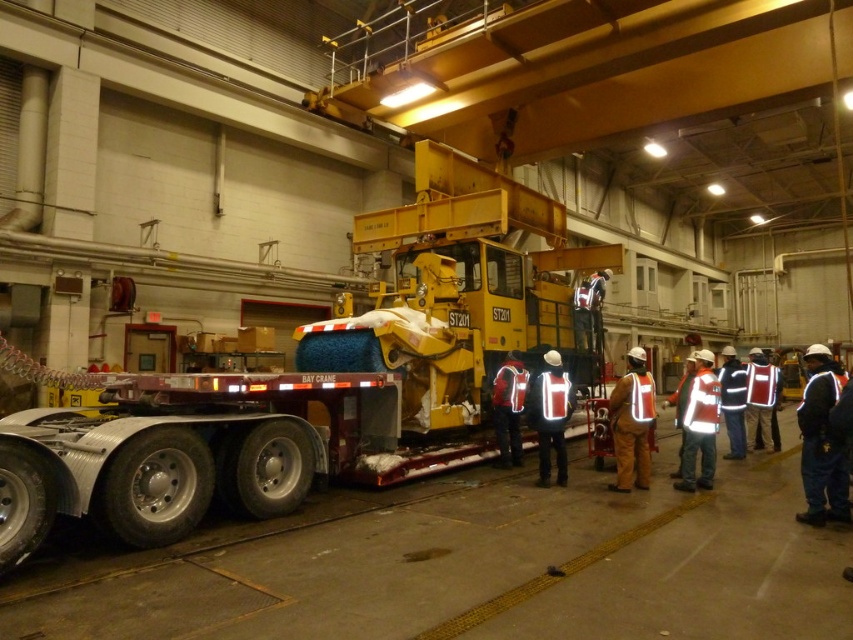
Question: Which of these objects is positioned closest to the reflective fabric vest at center?

Choices:
 (A) red reflective vest at right
 (B) white reflective vest at center
 (C) reflective orange safety vest at center

Answer: (B)

Question: Which point is farther from the camera taking this photo?

Choices:
 (A) (283, 397)
 (B) (747, 426)
 (C) (518, 461)

Answer: (B)

Question: Is white reflective jacket at lower right further to camera compared to red reflective vest at right?

Choices:
 (A) no
 (B) yes

Answer: (A)

Question: Is white reflective vest at center thinner than reflective fabric vest at center?

Choices:
 (A) no
 (B) yes

Answer: (A)

Question: Can you confirm if metallic trailer truck at center is positioned to the right of reflective fabric safety vest at right?

Choices:
 (A) no
 (B) yes

Answer: (A)

Question: Which object is closer to the camera taking this photo?

Choices:
 (A) reflective orange safety vest at center
 (B) red reflective vest at right

Answer: (A)